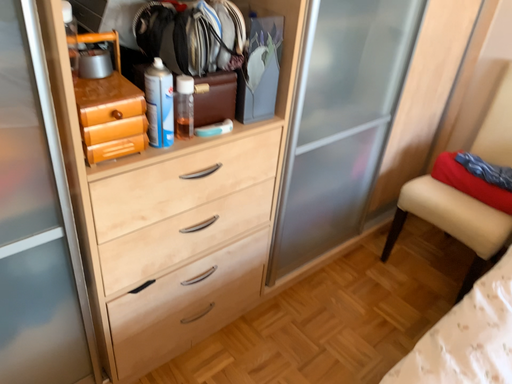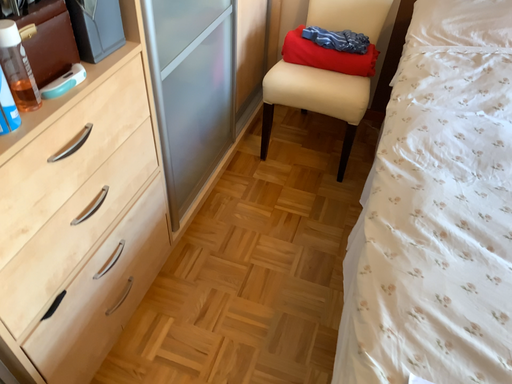
Question: Which way did the camera rotate in the video?

Choices:
 (A) rotated downward
 (B) rotated upward

Answer: (A)